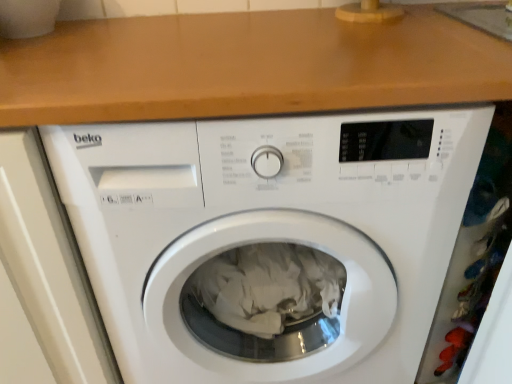
You are a GUI agent. You are given a task and a screenshot of the screen. Output one action in this format:
    pyautogui.click(x=<x>, y=<y>)
    Task: Click on the wooden at upper center
    
    Given the screenshot: What is the action you would take?
    pyautogui.click(x=245, y=67)

What do you see at coordinates (245, 67) in the screenshot? I see `wooden at upper center` at bounding box center [245, 67].

What is the approximate width of wooden at upper center?

wooden at upper center is 20.70 inches wide.

Find the location of a particular element. This screenshot has height=384, width=512. white plastic washing machine at center is located at coordinates (270, 239).

What do you see at coordinates (270, 239) in the screenshot?
I see `white plastic washing machine at center` at bounding box center [270, 239].

Measure the distance between point (158, 145) and camera.

Point (158, 145) and camera are 21.65 inches apart.

This screenshot has width=512, height=384. I want to click on wooden at upper center, so click(x=245, y=67).

Is white plastic washing machine at center to the left or to the right of wooden at upper center in the image?

white plastic washing machine at center is to the right of wooden at upper center.

Considering the positions of objects white plastic washing machine at center and wooden at upper center in the image provided, who is in front, white plastic washing machine at center or wooden at upper center?

Positioned in front is wooden at upper center.

Which is behind, point (336, 310) or point (376, 65)?

The point (336, 310) is farther from the camera.

From the image's perspective, is white plastic washing machine at center located above wooden at upper center?

Incorrect, from the image's perspective, white plastic washing machine at center is lower than wooden at upper center.

From a real-world perspective, is white plastic washing machine at center above or below wooden at upper center?

In terms of real-world spatial position, white plastic washing machine at center is below wooden at upper center.

Considering the relative sizes of white plastic washing machine at center and wooden at upper center in the image provided, is white plastic washing machine at center wider than wooden at upper center?

Yes, white plastic washing machine at center is wider than wooden at upper center.

Considering the relative sizes of white plastic washing machine at center and wooden at upper center in the image provided, is white plastic washing machine at center taller than wooden at upper center?

Yes, white plastic washing machine at center is taller than wooden at upper center.

Who is smaller, white plastic washing machine at center or wooden at upper center?

Smaller between the two is wooden at upper center.

In the scene shown: Is white plastic washing machine at center inside or outside of wooden at upper center?

white plastic washing machine at center is outside wooden at upper center.

Is white plastic washing machine at center next to wooden at upper center and touching it?

No, white plastic washing machine at center is not beside wooden at upper center.

Is white plastic washing machine at center looking in the opposite direction of wooden at upper center?

That's not correct — white plastic washing machine at center is not looking away from wooden at upper center.

How different are the orientations of white plastic washing machine at center and wooden at upper center in degrees?

9.55e-06 degrees.

Image resolution: width=512 pixels, height=384 pixels. What are the coordinates of `counter top on the left of the white plastic washing machine at center` in the screenshot? It's located at (245, 67).

Considering the positions of objects wooden at upper center and white plastic washing machine at center in the image provided, who is more to the left, wooden at upper center or white plastic washing machine at center?

From the viewer's perspective, wooden at upper center appears more on the left side.

Does wooden at upper center lie in front of white plastic washing machine at center?

Yes, wooden at upper center is closer to the camera.

Is point (99, 94) positioned after point (467, 143)?

No, it is in front of (467, 143).

From the image's perspective, between wooden at upper center and white plastic washing machine at center, who is located below?

From the image's view, white plastic washing machine at center is below.

From a real-world perspective, is wooden at upper center positioned above or below white plastic washing machine at center?

wooden at upper center is situated higher than white plastic washing machine at center in the real world.

Is wooden at upper center thinner than white plastic washing machine at center?

Yes.

Between wooden at upper center and white plastic washing machine at center, which one has less height?

Answer: With less height is wooden at upper center.

Is wooden at upper center bigger than white plastic washing machine at center?

No.

Is wooden at upper center inside the boundaries of white plastic washing machine at center, or outside?

wooden at upper center exists outside the volume of white plastic washing machine at center.

Is wooden at upper center far away from white plastic washing machine at center?

Actually, wooden at upper center and white plastic washing machine at center are a little close together.

Is wooden at upper center facing away from white plastic washing machine at center?

No, wooden at upper center is not facing away from white plastic washing machine at center.

How many degrees apart are the facing directions of wooden at upper center and white plastic washing machine at center?

They differ by 9.55e-06 degrees in their facing directions.

Locate an element on the screen. counter top that is above the white plastic washing machine at center (from the image's perspective) is located at coordinates (245, 67).

Find the location of a particular element. This screenshot has height=384, width=512. counter top on the left of white plastic washing machine at center is located at coordinates (245, 67).

Image resolution: width=512 pixels, height=384 pixels. In order to click on counter top in front of the white plastic washing machine at center in this screenshot , I will do `click(245, 67)`.